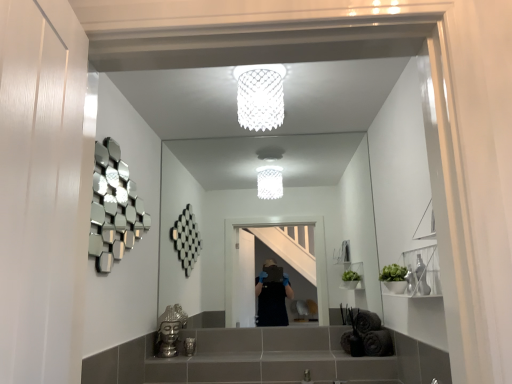
Identify the location of vacant area situated below clear glass mirror at center (from a real-world perspective). This screenshot has height=384, width=512. (268, 344).